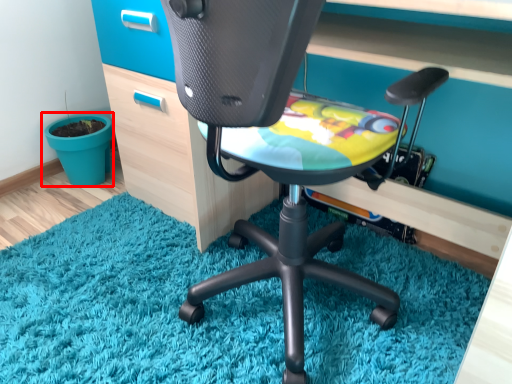
Question: Observing the image, what is the correct spatial positioning of flowerpot (annotated by the red box) in reference to chair?

Choices:
 (A) right
 (B) left

Answer: (B)